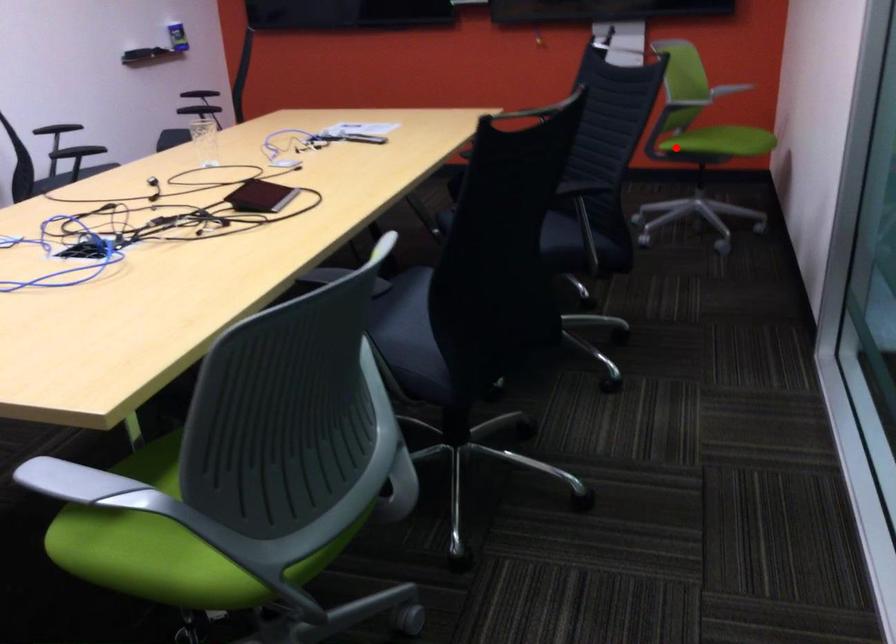
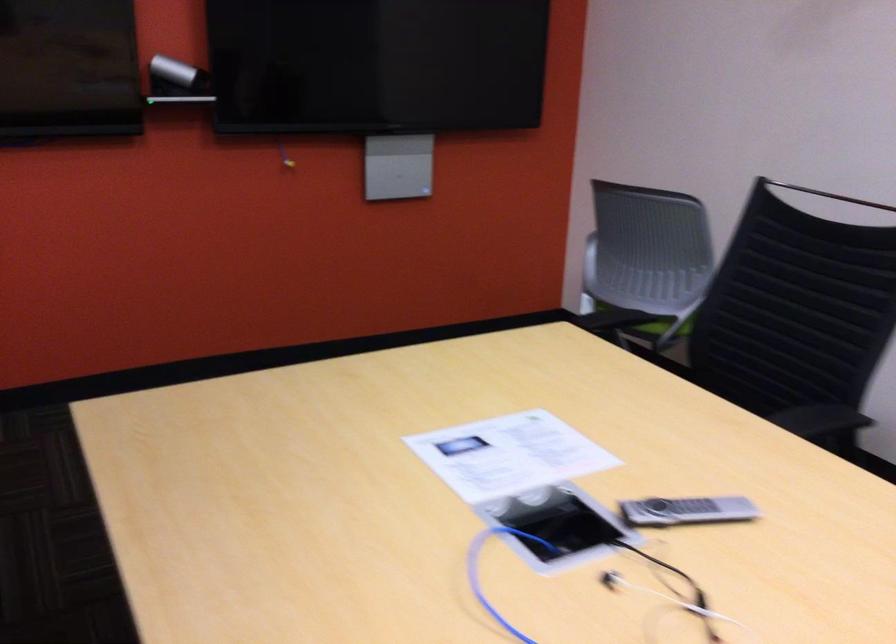
In the second image, find the point that corresponds to the highlighted location in the first image.

(653, 325)